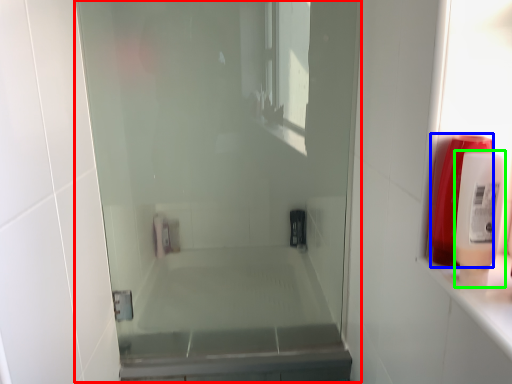
Question: Which object is the closest to the screen door (highlighted by a red box)? Choose among these: soap dispenser (highlighted by a blue box) or soap dispenser (highlighted by a green box).

Choices:
 (A) soap dispenser
 (B) soap dispenser

Answer: (A)